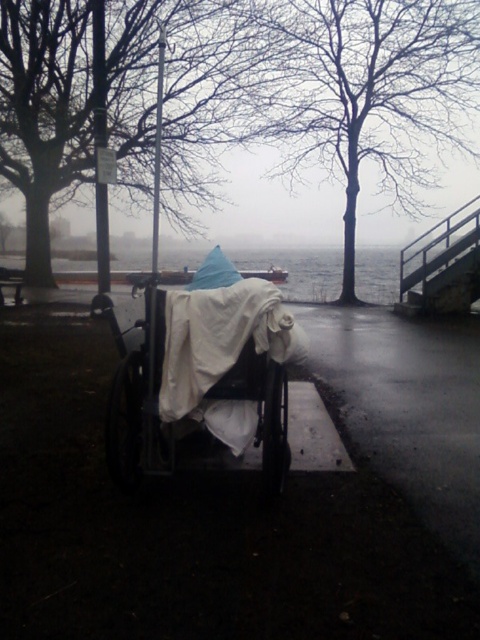
You are standing at the edge of the lake in the image, looking towards the stone structure. There is a point marked at coordinates (363, 92). What object is located at this point?

The point at coordinates (363, 92) indicates bare branches at upper center.